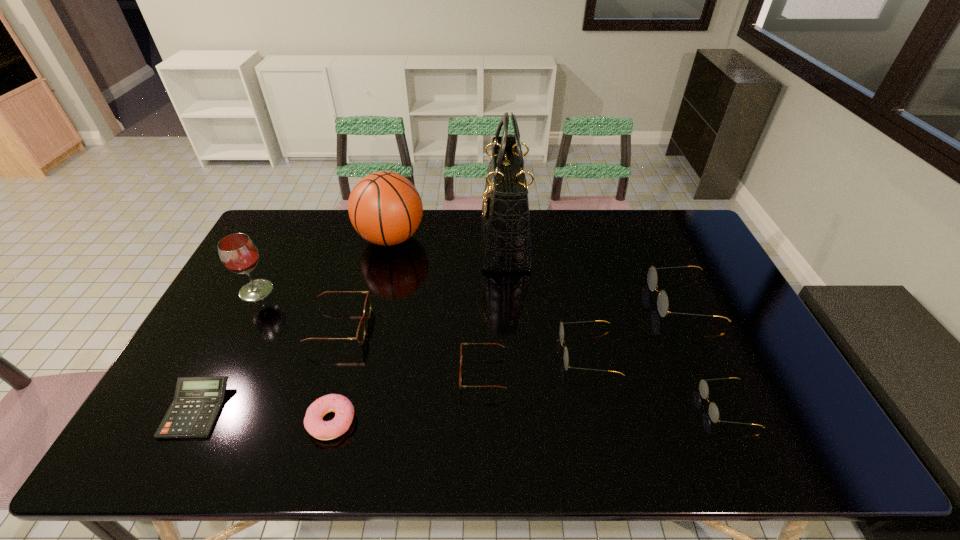
Find the location of a particular element. blank space located on the temples of the nearest gold spectacles is located at coordinates (562, 406).

The height and width of the screenshot is (540, 960). I want to click on free location located 0.100m on the temples of the nearest gold spectacles, so point(662,406).

You are a GUI agent. You are given a task and a screenshot of the screen. Output one action in this format:
    pyautogui.click(x=<x>, y=<y>)
    Task: Click on the vacant position located on the temples of the nearest gold spectacles
    The image size is (960, 540).
    Given the screenshot: What is the action you would take?
    pyautogui.click(x=578, y=406)

Where is `vacant space located 0.100m on the right of the pink doughnut`? vacant space located 0.100m on the right of the pink doughnut is located at coordinates (396, 421).

The height and width of the screenshot is (540, 960). I want to click on vacant area situated 0.340m on the back of the calculator, so click(258, 291).

Locate an element on the screen. handbag that is at the far edge is located at coordinates (505, 226).

The width and height of the screenshot is (960, 540). In order to click on basketball at the far edge in this screenshot , I will do `click(385, 208)`.

The image size is (960, 540). What are the coordinates of `spectacles located in the near edge section of the desktop` in the screenshot? It's located at (703, 386).

Where is `doughnut present at the near edge`? The width and height of the screenshot is (960, 540). doughnut present at the near edge is located at coordinates (344, 411).

Find the location of a particular element. calculator that is positioned at the near edge is located at coordinates (197, 402).